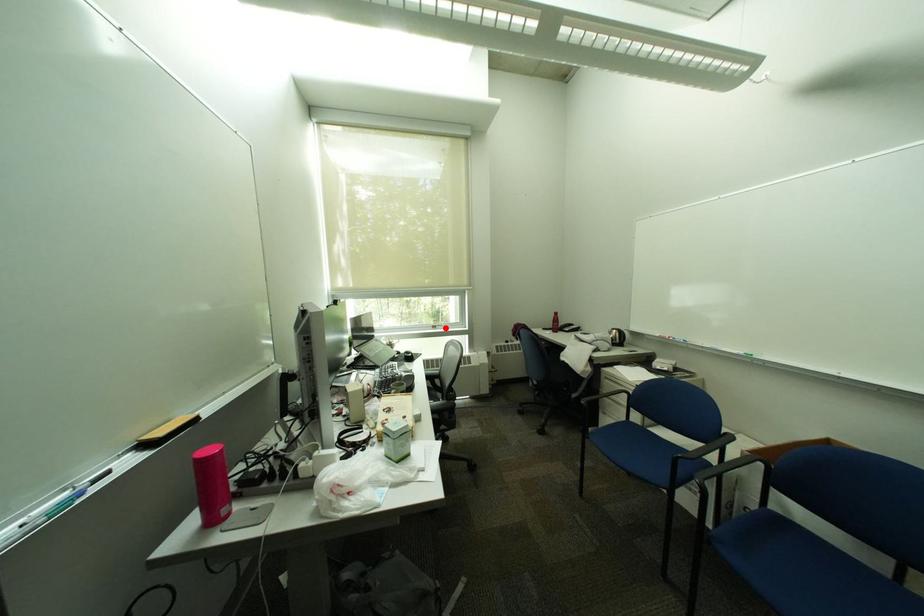
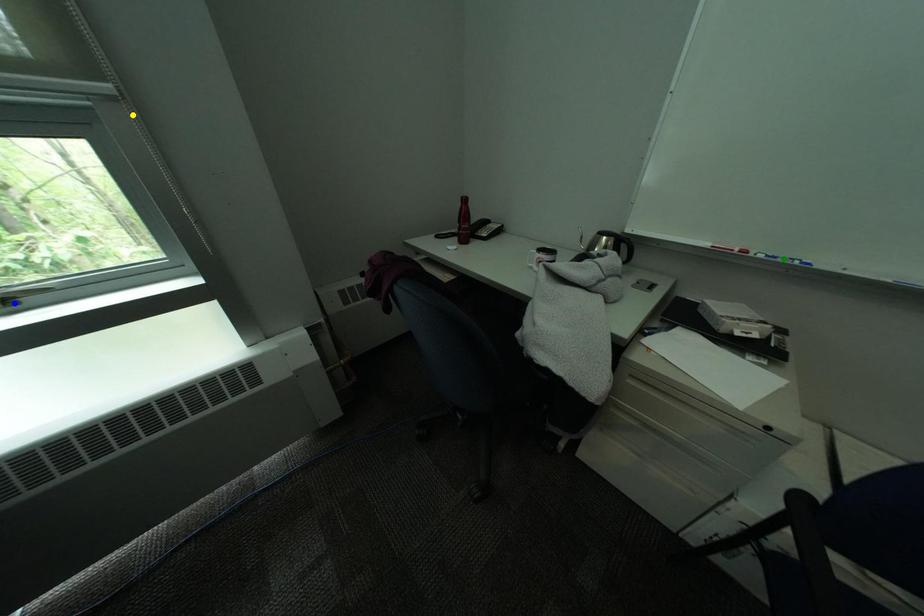
Question: I am providing you with two images of the same scene from different viewpoints. A red point is marked on the first image. You are given multiple points on the second image. In image 2, which mark is for the same physical point as the one in image 1?

Choices:
 (A) blue point
 (B) yellow point
 (C) green point

Answer: (A)